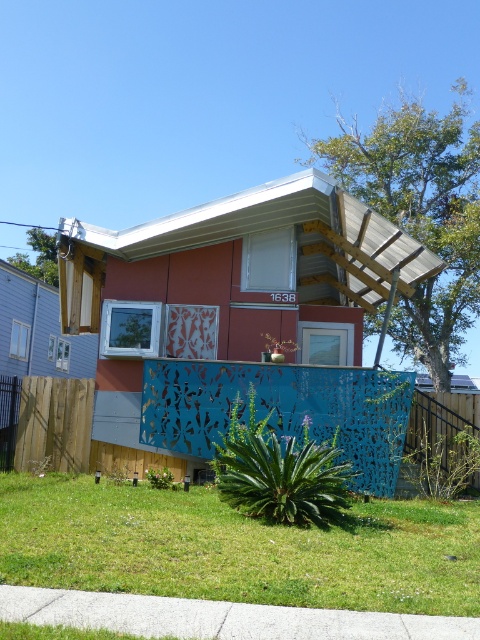
Question: Does green grass at lower center appear on the left side of blue perforated metal fence at center?

Choices:
 (A) yes
 (B) no

Answer: (A)

Question: Which of the following is the farthest from the observer?

Choices:
 (A) (332, 529)
 (B) (459, 432)

Answer: (B)

Question: Which point appears farthest from the camera in this image?

Choices:
 (A) (101, 561)
 (B) (462, 476)
 (C) (431, 400)

Answer: (C)

Question: Which of the following is the closest to the observer?

Choices:
 (A) green grass at lower center
 (B) blue perforated metal fence at center
 (C) blue perforated metal fence at lower center

Answer: (A)

Question: Does green grass at lower center have a lesser width compared to blue perforated metal fence at lower center?

Choices:
 (A) no
 (B) yes

Answer: (B)

Question: Is green grass at lower center bigger than blue perforated metal fence at lower center?

Choices:
 (A) no
 (B) yes

Answer: (A)